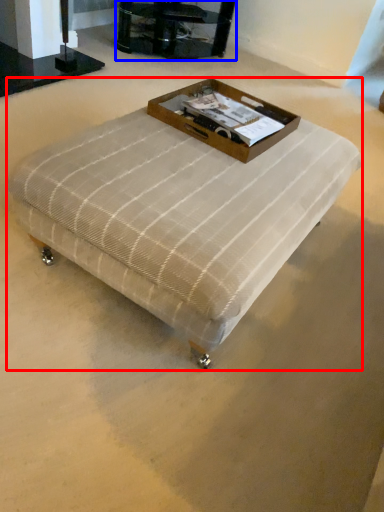
Question: Which point is closer to the camera, table (highlighted by a red box) or furniture (highlighted by a blue box)?

Choices:
 (A) table
 (B) furniture

Answer: (A)